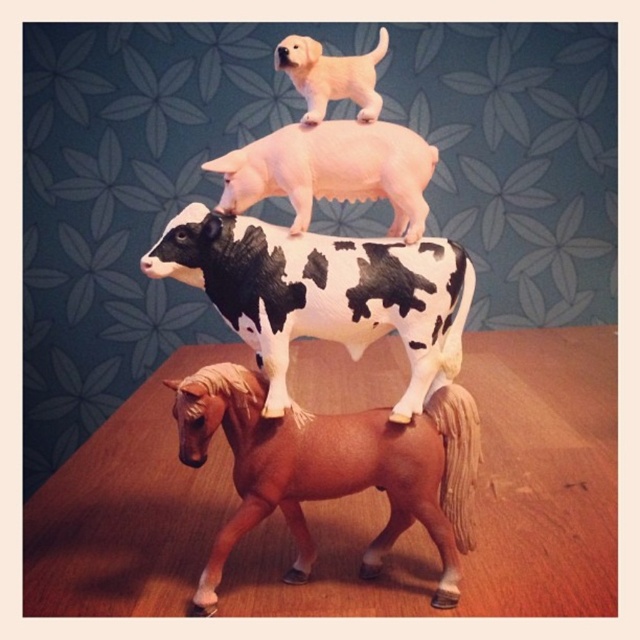
Question: Which point is farther from the camera taking this photo?

Choices:
 (A) (269, 136)
 (B) (588, 515)
 (C) (369, 326)

Answer: (B)

Question: Observing the image, what is the correct spatial positioning of white matte pig at upper center in reference to light brown matte pony at upper center?

Choices:
 (A) above
 (B) below

Answer: (B)

Question: Which of the following is the farthest from the observer?

Choices:
 (A) (336, 308)
 (B) (179, 448)

Answer: (A)

Question: Considering the real-world distances, which object is farthest from the light brown matte pony at upper center?

Choices:
 (A) black and white spotted cow at center
 (B) wooden table at center
 (C) brown matte horse at bottom

Answer: (B)

Question: Is white matte pig at upper center above light brown matte pony at upper center?

Choices:
 (A) yes
 (B) no

Answer: (B)

Question: Can you confirm if wooden table at center is smaller than white matte pig at upper center?

Choices:
 (A) yes
 (B) no

Answer: (B)